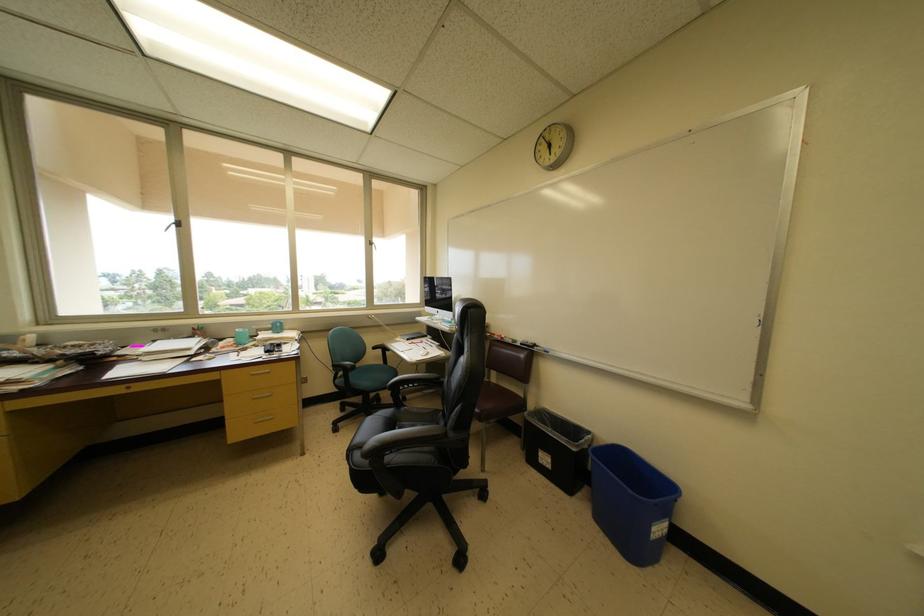
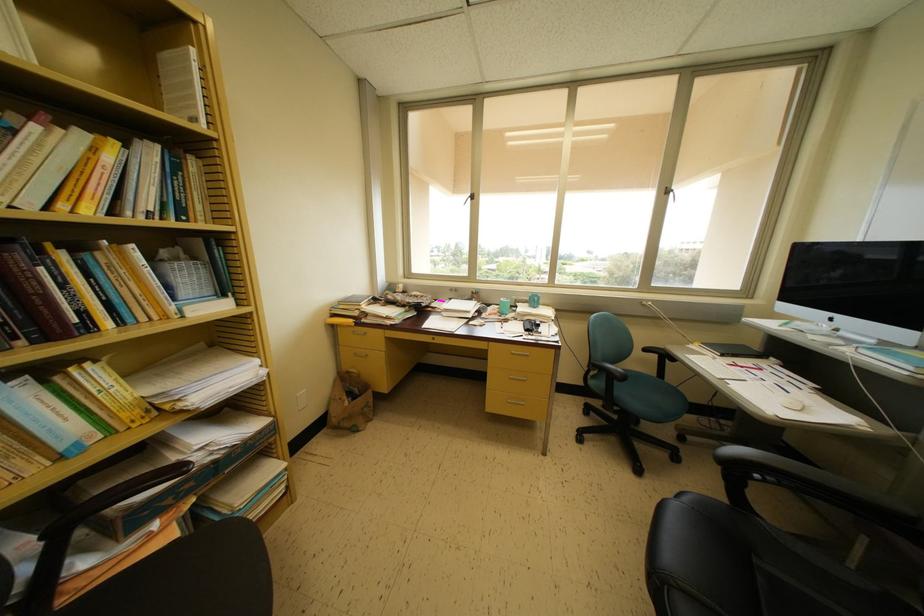
In the second image, find the point that corresponds to (278,353) in the first image.

(537, 331)